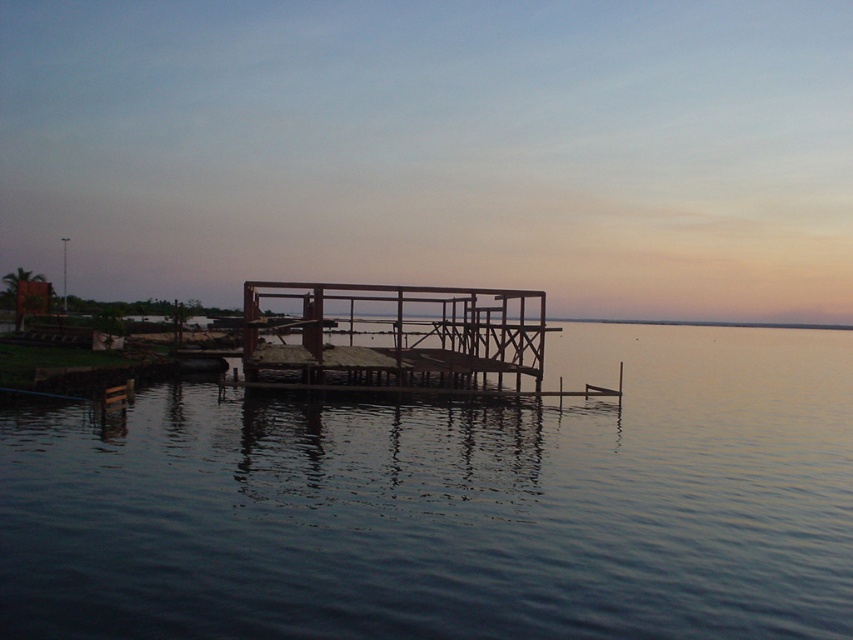
Which is behind, point (573, 356) or point (274, 353)?

Point (573, 356)

Can you confirm if transparent water at center is wider than wooden dock at center?

Yes.

Looking at this image, who is more distant from viewer, (827, 481) or (492, 362)?

The point (492, 362) is behind.

What are the coordinates of `transparent water at center` in the screenshot? It's located at (453, 506).